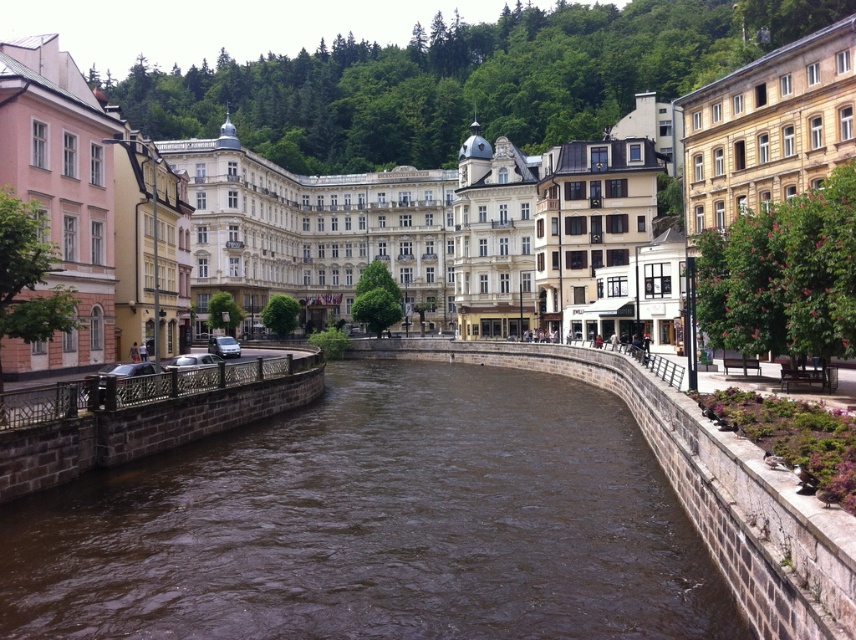
Does brown stone river at center have a lesser height compared to brown stone buildings at center?

Yes.

Which is behind, point (337, 561) or point (501, 128)?

The point (501, 128) is more distant.

This screenshot has width=856, height=640. What do you see at coordinates (376, 524) in the screenshot? I see `brown stone river at center` at bounding box center [376, 524].

At what (x,y) coordinates should I click in order to perform the action: click on brown stone river at center. Please return your answer as a coordinate pair (x, y). The image size is (856, 640). Looking at the image, I should click on (376, 524).